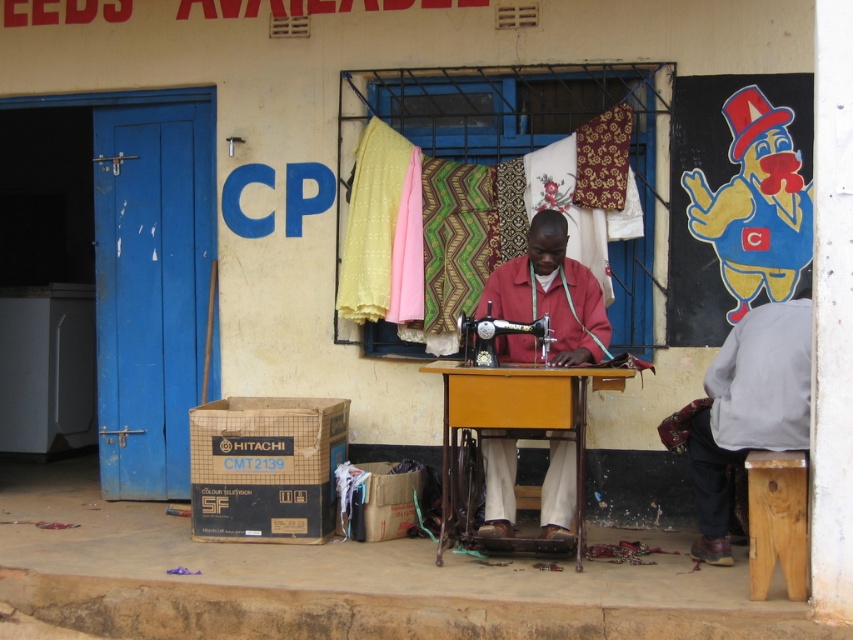
Can you confirm if metallic sewing machine at center is taller than light brown wooden stool at lower right?

Yes, metallic sewing machine at center is taller than light brown wooden stool at lower right.

Is metallic sewing machine at center behind light brown wooden stool at lower right?

Yes.

Is point (468, 496) more distant than point (804, 451)?

Yes, it is.

The width and height of the screenshot is (853, 640). Identify the location of metallic sewing machine at center. (508, 429).

Which of these two, gray fabric at lower right or red matte sewing machine at center, stands shorter?

red matte sewing machine at center

Is point (769, 413) less distant than point (553, 289)?

Yes, point (769, 413) is in front of point (553, 289).

Image resolution: width=853 pixels, height=640 pixels. In order to click on gray fabric at lower right in this screenshot , I will do `click(747, 410)`.

Is metallic sewing machine at center smaller than red matte sewing machine at center?

Actually, metallic sewing machine at center might be larger than red matte sewing machine at center.

Is metallic sewing machine at center to the right of red matte sewing machine at center from the viewer's perspective?

In fact, metallic sewing machine at center is to the left of red matte sewing machine at center.

Locate an element on the screen. The height and width of the screenshot is (640, 853). metallic sewing machine at center is located at coordinates (508, 429).